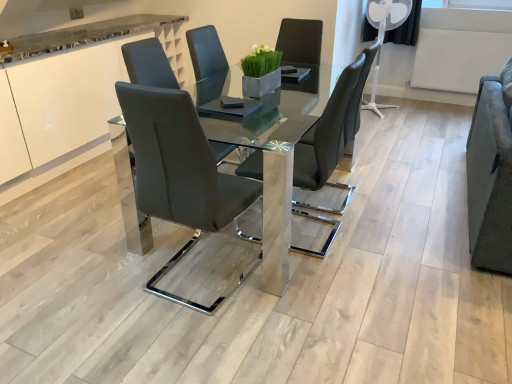
The height and width of the screenshot is (384, 512). I want to click on vacant space underneath matte black chair at center, the 2th chair viewed from the right (from a real-world perspective), so click(x=189, y=284).